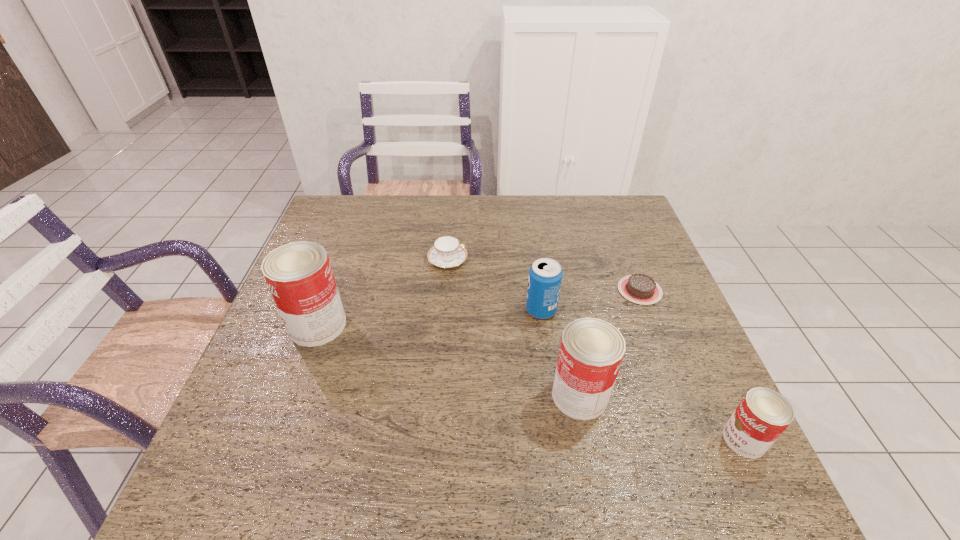
This screenshot has height=540, width=960. I want to click on vacant area that lies between the shortest object and the third shortest object, so click(692, 364).

I want to click on vacant area that lies between the teacup and the leftmost can, so click(x=383, y=293).

The image size is (960, 540). What are the coordinates of `vacant space that is in between the soda can and the shortest object` in the screenshot? It's located at (590, 300).

This screenshot has height=540, width=960. I want to click on vacant area between the third tallest object and the shortest object, so click(590, 300).

Find the location of a particular element. This screenshot has height=540, width=960. free space between the leftmost object and the shortest object is located at coordinates coord(479,308).

Where is `free area in between the leftmost object and the soda can`? free area in between the leftmost object and the soda can is located at coordinates (429, 318).

You are a GUI agent. You are given a task and a screenshot of the screen. Output one action in this format:
    pyautogui.click(x=<x>, y=<y>)
    Task: Click on the object identified as the fourth closest to the leftmost object
    The image size is (960, 540).
    Given the screenshot: What is the action you would take?
    pyautogui.click(x=638, y=288)

Identify which object is the third closest to the second shortest can. Please provide its 2D coordinates. Your answer should be formatted as a tuple, i.e. [(x, y)], where the tuple contains the x and y coordinates of a point satisfying the conditions above.

[(638, 288)]

The image size is (960, 540). I want to click on the closest can to the leftmost can, so click(x=591, y=351).

At what (x,y) coordinates should I click in order to perform the action: click on the third closest can to the chocolate cake. Please return your answer as a coordinate pair (x, y). The height and width of the screenshot is (540, 960). Looking at the image, I should click on (299, 275).